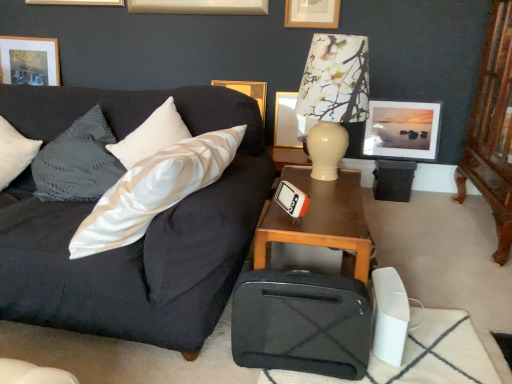
Question: From a real-world perspective, is matte gold picture frame at upper left, positioned as the 1th picture frame in left-to-right order, above or below matte gold picture frame at upper center, the 3th picture frame when ordered from right to left?

Choices:
 (A) above
 (B) below

Answer: (A)

Question: Is point (53, 61) positioned closer to the camera than point (280, 94)?

Choices:
 (A) closer
 (B) farther

Answer: (B)

Question: Which of these objects is positioned farthest from the matte gold picture frame at upper center, which is the third picture frame in left-to-right order?

Choices:
 (A) matte gold picture frame at upper left, which is the fifth picture frame from right to left
 (B) matte glass picture frame at upper right, the first picture frame positioned from the right
 (C) wooden carved dresser at right
 (D) white satin pillow at center
 (E) dark gray fabric couch at left

Answer: (A)

Question: Which object is positioned farthest from the matte gold picture frame at upper center, which ranks as the fourth picture frame in left-to-right order?

Choices:
 (A) wooden carved dresser at right
 (B) brown wooden table at center
 (C) matte gold picture frame at upper left, which is the fifth picture frame from right to left
 (D) matte glass picture frame at upper right, positioned as the 5th picture frame in left-to-right order
 (E) matte gold picture frame at upper center, the 3th picture frame when ordered from right to left

Answer: (C)